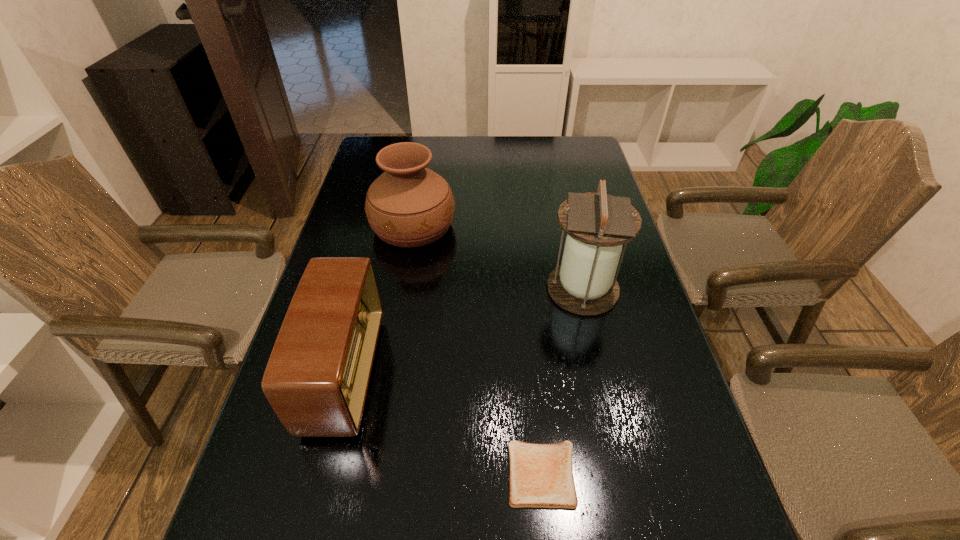
You are a GUI agent. You are given a task and a screenshot of the screen. Output one action in this format:
    pyautogui.click(x=<x>, y=<y>)
    Task: Click on the second farthest object
    
    Given the screenshot: What is the action you would take?
    pyautogui.click(x=597, y=224)

Find the location of `lantern`. lantern is located at coordinates (597, 224).

Identify the location of urn. (409, 205).

Where is `radio receiver`? Image resolution: width=960 pixels, height=540 pixels. radio receiver is located at coordinates (316, 380).

This screenshot has height=540, width=960. In order to click on the shortest object in this screenshot , I will do `click(541, 475)`.

Find the location of `vacant space situated 0.180m on the back of the third nearest object`. vacant space situated 0.180m on the back of the third nearest object is located at coordinates (568, 225).

The width and height of the screenshot is (960, 540). In order to click on vacant space located 0.090m on the right of the urn in this screenshot , I will do `click(486, 226)`.

Locate an element on the screen. This screenshot has width=960, height=540. vacant space located 0.090m on the front-facing side of the radio receiver is located at coordinates click(x=415, y=374).

Image resolution: width=960 pixels, height=540 pixels. What are the coordinates of `free space located on the right of the toast` in the screenshot? It's located at (705, 474).

Where is `urn at the left edge`? The width and height of the screenshot is (960, 540). urn at the left edge is located at coordinates (409, 205).